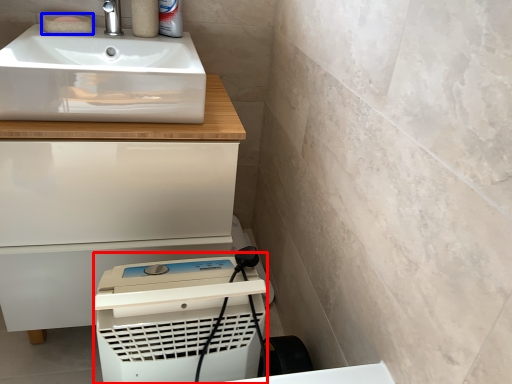
Question: Which object appears farthest to the camera in this image, appliance (highlighted by a red box) or soap (highlighted by a blue box)?

Choices:
 (A) appliance
 (B) soap

Answer: (B)